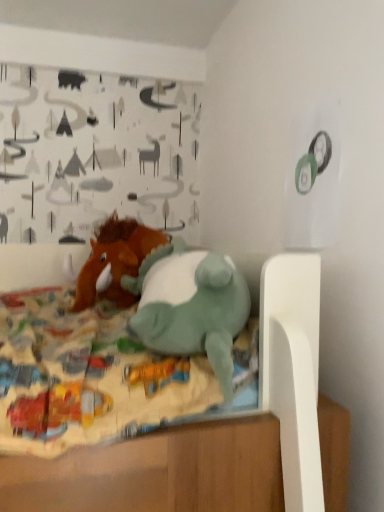
This screenshot has width=384, height=512. What do you see at coordinates (190, 306) in the screenshot?
I see `teal plush dinosaur at center, the first toy viewed from the front` at bounding box center [190, 306].

Where is `teal plush dinosaur at center, the first toy viewed from the front`? teal plush dinosaur at center, the first toy viewed from the front is located at coordinates (190, 306).

At what (x,y) coordinates should I click in order to perform the action: click on fuzzy brown stuffed horse at center, which is counted as the 1th toy, starting from the back. Please return your answer as a coordinate pair (x, y). The width and height of the screenshot is (384, 512). Looking at the image, I should click on (115, 262).

Describe the element at coordinates (115, 262) in the screenshot. I see `fuzzy brown stuffed horse at center, which is counted as the 1th toy, starting from the back` at that location.

At what (x,y) coordinates should I click in order to perform the action: click on teal plush dinosaur at center, the second toy positioned from the back. Please return your answer as a coordinate pair (x, y). This screenshot has width=384, height=512. Looking at the image, I should click on (190, 306).

Between teal plush dinosaur at center, the second toy positioned from the back, and fuzzy brown stuffed horse at center, the second toy from the front, which one appears on the right side from the viewer's perspective?

Positioned to the right is teal plush dinosaur at center, the second toy positioned from the back.

Consider the image. Relative to fuzzy brown stuffed horse at center, the second toy from the front, is teal plush dinosaur at center, the second toy positioned from the back, in front or behind?

teal plush dinosaur at center, the second toy positioned from the back, is in front of fuzzy brown stuffed horse at center, the second toy from the front.

Which is in front, point (172, 270) or point (133, 302)?

The point (172, 270) is in front.

From the image's perspective, is teal plush dinosaur at center, the second toy positioned from the back, located above or below fuzzy brown stuffed horse at center, which is counted as the 1th toy, starting from the back?

Clearly, from the image's perspective, teal plush dinosaur at center, the second toy positioned from the back, is below fuzzy brown stuffed horse at center, which is counted as the 1th toy, starting from the back.

From a real-world perspective, is teal plush dinosaur at center, the first toy viewed from the front, on top of fuzzy brown stuffed horse at center, which is counted as the 1th toy, starting from the back?

No, from a real-world perspective, teal plush dinosaur at center, the first toy viewed from the front, is not above fuzzy brown stuffed horse at center, which is counted as the 1th toy, starting from the back.

Considering the sizes of objects teal plush dinosaur at center, the first toy viewed from the front, and fuzzy brown stuffed horse at center, which is counted as the 1th toy, starting from the back, in the image provided, who is wider, teal plush dinosaur at center, the first toy viewed from the front, or fuzzy brown stuffed horse at center, which is counted as the 1th toy, starting from the back,?

With larger width is fuzzy brown stuffed horse at center, which is counted as the 1th toy, starting from the back.

Can you confirm if teal plush dinosaur at center, the second toy positioned from the back, is taller than fuzzy brown stuffed horse at center, which is counted as the 1th toy, starting from the back?

Incorrect, the height of teal plush dinosaur at center, the second toy positioned from the back, is not larger of that of fuzzy brown stuffed horse at center, which is counted as the 1th toy, starting from the back.

Does teal plush dinosaur at center, the second toy positioned from the back, have a smaller size compared to fuzzy brown stuffed horse at center, which is counted as the 1th toy, starting from the back?

No, teal plush dinosaur at center, the second toy positioned from the back, is not smaller than fuzzy brown stuffed horse at center, which is counted as the 1th toy, starting from the back.

Can we say teal plush dinosaur at center, the first toy viewed from the front, lies outside fuzzy brown stuffed horse at center, the second toy from the front?

Absolutely, teal plush dinosaur at center, the first toy viewed from the front, is external to fuzzy brown stuffed horse at center, the second toy from the front.

Are teal plush dinosaur at center, the second toy positioned from the back, and fuzzy brown stuffed horse at center, the second toy from the front, beside each other?

There is a gap between teal plush dinosaur at center, the second toy positioned from the back, and fuzzy brown stuffed horse at center, the second toy from the front.

Is teal plush dinosaur at center, the second toy positioned from the back, aimed at fuzzy brown stuffed horse at center, which is counted as the 1th toy, starting from the back?

No, teal plush dinosaur at center, the second toy positioned from the back, is not turned towards fuzzy brown stuffed horse at center, which is counted as the 1th toy, starting from the back.

How different are the orientations of teal plush dinosaur at center, the first toy viewed from the front, and fuzzy brown stuffed horse at center, the second toy from the front, in degrees?

94.6 degrees separate the facing orientations of teal plush dinosaur at center, the first toy viewed from the front, and fuzzy brown stuffed horse at center, the second toy from the front.

I want to click on toy that is below the fuzzy brown stuffed horse at center, the second toy from the front (from the image's perspective), so click(x=190, y=306).

Does fuzzy brown stuffed horse at center, the second toy from the front, appear on the left side of teal plush dinosaur at center, the second toy positioned from the back?

Yes.

Which object is closer to the camera, fuzzy brown stuffed horse at center, which is counted as the 1th toy, starting from the back, or teal plush dinosaur at center, the first toy viewed from the front?

teal plush dinosaur at center, the first toy viewed from the front, is closer to the camera.

Is point (129, 228) closer or farther from the camera than point (171, 244)?

Point (129, 228) appears to be closer to the viewer than point (171, 244).

From the image's perspective, is fuzzy brown stuffed horse at center, which is counted as the 1th toy, starting from the back, located above or below teal plush dinosaur at center, the first toy viewed from the front?

Based on their image positions, fuzzy brown stuffed horse at center, which is counted as the 1th toy, starting from the back, is located above teal plush dinosaur at center, the first toy viewed from the front.

From a real-world perspective, who is located higher, fuzzy brown stuffed horse at center, the second toy from the front, or teal plush dinosaur at center, the second toy positioned from the back?

fuzzy brown stuffed horse at center, the second toy from the front, from a real-world perspective.

In terms of width, does fuzzy brown stuffed horse at center, which is counted as the 1th toy, starting from the back, look wider or thinner when compared to teal plush dinosaur at center, the first toy viewed from the front?

fuzzy brown stuffed horse at center, which is counted as the 1th toy, starting from the back, is wider than teal plush dinosaur at center, the first toy viewed from the front.

From their relative heights in the image, would you say fuzzy brown stuffed horse at center, which is counted as the 1th toy, starting from the back, is taller or shorter than teal plush dinosaur at center, the first toy viewed from the front?

Clearly, fuzzy brown stuffed horse at center, which is counted as the 1th toy, starting from the back, is taller compared to teal plush dinosaur at center, the first toy viewed from the front.

Considering the relative sizes of fuzzy brown stuffed horse at center, the second toy from the front, and teal plush dinosaur at center, the first toy viewed from the front, in the image provided, is fuzzy brown stuffed horse at center, the second toy from the front, smaller than teal plush dinosaur at center, the first toy viewed from the front,?

Yes, fuzzy brown stuffed horse at center, the second toy from the front, is smaller than teal plush dinosaur at center, the first toy viewed from the front.

Choose the correct answer: Is fuzzy brown stuffed horse at center, which is counted as the 1th toy, starting from the back, inside teal plush dinosaur at center, the first toy viewed from the front, or outside it?

fuzzy brown stuffed horse at center, which is counted as the 1th toy, starting from the back, is not inside teal plush dinosaur at center, the first toy viewed from the front, it's outside.

Is the surface of fuzzy brown stuffed horse at center, the second toy from the front, in direct contact with teal plush dinosaur at center, the second toy positioned from the back?

No, fuzzy brown stuffed horse at center, the second toy from the front, is not with teal plush dinosaur at center, the second toy positioned from the back.

Is fuzzy brown stuffed horse at center, the second toy from the front, looking in the opposite direction of teal plush dinosaur at center, the first toy viewed from the front?

No.

Where is `toy located below the fuzzy brown stuffed horse at center, which is counted as the 1th toy, starting from the back (from the image's perspective)`? The height and width of the screenshot is (512, 384). toy located below the fuzzy brown stuffed horse at center, which is counted as the 1th toy, starting from the back (from the image's perspective) is located at coordinates (190, 306).

You are a GUI agent. You are given a task and a screenshot of the screen. Output one action in this format:
    pyautogui.click(x=<x>, y=<y>)
    Task: Click on the toy that appears below the fuzzy brown stuffed horse at center, the second toy from the front (from the image's perspective)
    The width and height of the screenshot is (384, 512).
    Given the screenshot: What is the action you would take?
    pyautogui.click(x=190, y=306)

The width and height of the screenshot is (384, 512). I want to click on toy beneath the fuzzy brown stuffed horse at center, which is counted as the 1th toy, starting from the back (from a real-world perspective), so click(190, 306).